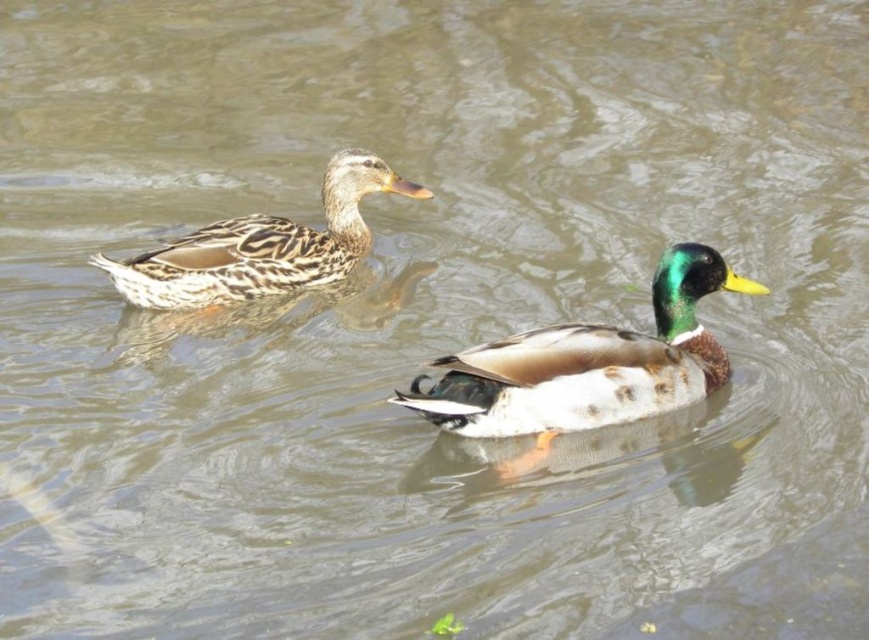
Question: Does green glossy duck at center have a greater width compared to speckled feathered duck at left?

Choices:
 (A) no
 (B) yes

Answer: (A)

Question: Which object is closer to the camera taking this photo?

Choices:
 (A) green glossy duck at center
 (B) speckled feathered duck at left

Answer: (A)

Question: Is green glossy duck at center closer to camera compared to speckled feathered duck at left?

Choices:
 (A) yes
 (B) no

Answer: (A)

Question: From the image, what is the correct spatial relationship of green glossy duck at center in relation to speckled feathered duck at left?

Choices:
 (A) left
 (B) right

Answer: (B)